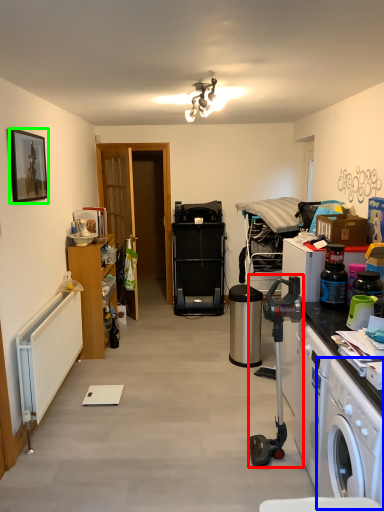
Question: Based on their relative distances, which object is nearer to appliance (highlighted by a red box)? Choose from washing machine (highlighted by a blue box) and picture frame (highlighted by a green box).

Choices:
 (A) washing machine
 (B) picture frame

Answer: (A)